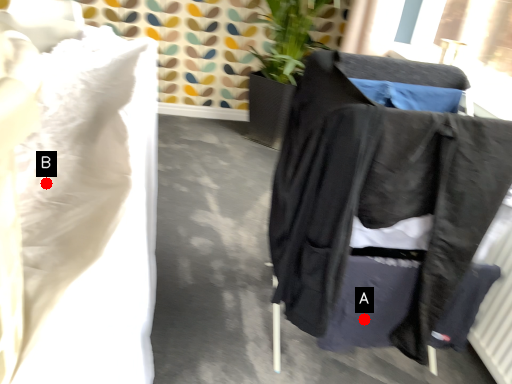
Question: Two points are circled on the image, labeled by A and B beside each circle. Which of the following is the farthest from the observer?

Choices:
 (A) A is further
 (B) B is further

Answer: (A)